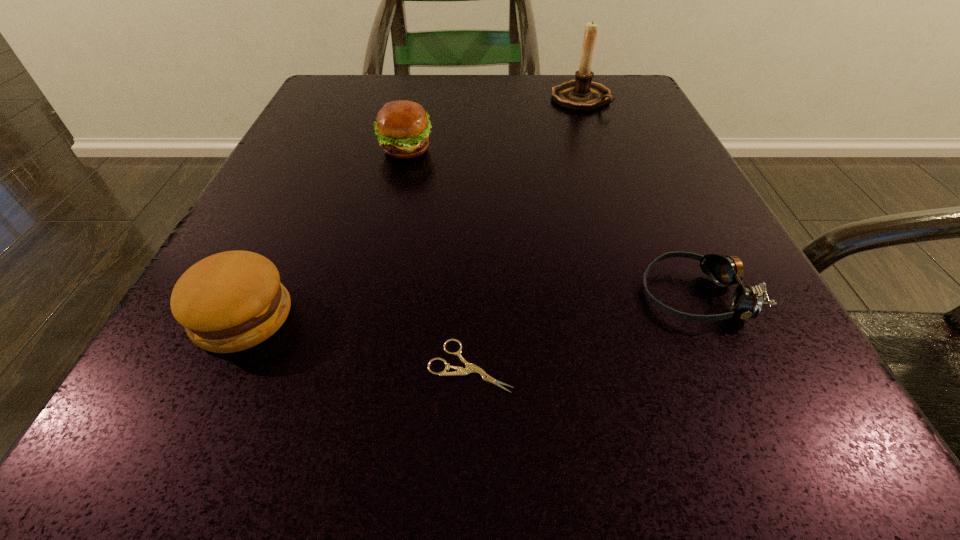
Where is `free space at the far edge of the desktop`? This screenshot has width=960, height=540. free space at the far edge of the desktop is located at coordinates (430, 84).

Where is `free space at the near edge of the desktop`? free space at the near edge of the desktop is located at coordinates (399, 401).

Locate an element on the screen. blank space at the left edge of the desktop is located at coordinates (362, 149).

In the image, there is a desktop. At what (x,y) coordinates should I click in order to perform the action: click on vacant space at the right edge. Please return your answer as a coordinate pair (x, y). The image size is (960, 540). Looking at the image, I should click on (604, 204).

Where is `vacant space at the far left corner of the desktop`? This screenshot has height=540, width=960. vacant space at the far left corner of the desktop is located at coordinates (337, 89).

Locate an element on the screen. vacant area at the near left corner of the desktop is located at coordinates (192, 467).

In the image, there is a desktop. Where is `free space at the far right corner`? free space at the far right corner is located at coordinates (628, 119).

In the image, there is a desktop. Where is `blank space at the near right corner`? blank space at the near right corner is located at coordinates coord(782,426).

The height and width of the screenshot is (540, 960). Find the location of `vacant space that's between the farthest object and the fourth tallest object`. vacant space that's between the farthest object and the fourth tallest object is located at coordinates (637, 197).

Where is `free spot between the third object from right to left and the second shortest object`? free spot between the third object from right to left and the second shortest object is located at coordinates (582, 330).